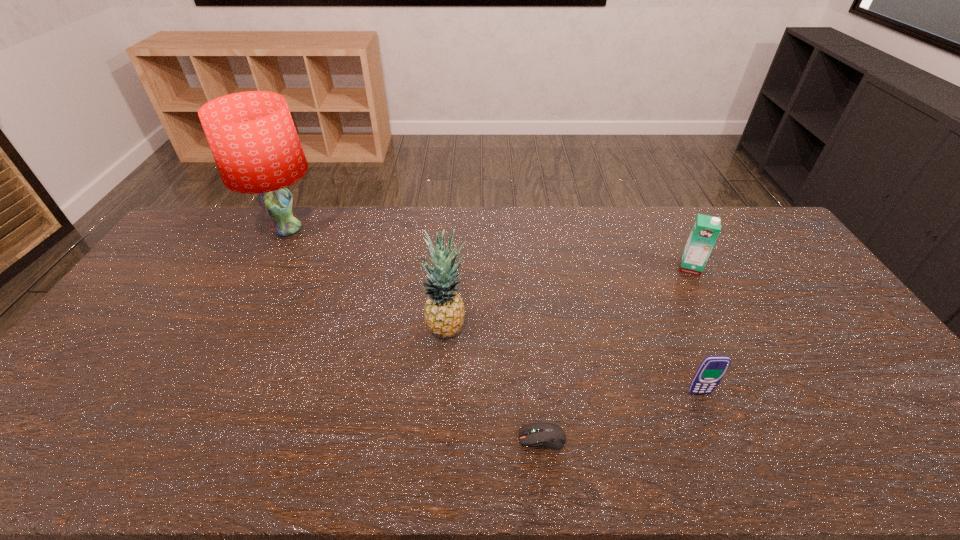
Where is `vacant space at the near edge of the desktop`? vacant space at the near edge of the desktop is located at coordinates (869, 463).

In the image, there is a desktop. What are the coordinates of `vacant area at the right edge` in the screenshot? It's located at (804, 334).

In the image, there is a desktop. Where is `free space at the far right corner`? The height and width of the screenshot is (540, 960). free space at the far right corner is located at coordinates (739, 232).

This screenshot has width=960, height=540. In order to click on free space at the near right corner in this screenshot , I will do `click(910, 469)`.

You are a GUI agent. You are given a task and a screenshot of the screen. Output one action in this format:
    pyautogui.click(x=<x>, y=<y>)
    Task: Click on the free space between the shortest object and the fourth tallest object
    The image size is (960, 540).
    Given the screenshot: What is the action you would take?
    pyautogui.click(x=620, y=416)

Where is `vacant area that lies between the farthest object and the nearest object`? vacant area that lies between the farthest object and the nearest object is located at coordinates (415, 334).

I want to click on empty space between the rightmost object and the fourth object from right to left, so click(x=568, y=298).

Identify the location of free space between the leftmost object and the cellular telephone. The image size is (960, 540). (493, 312).

Identify the location of empty space that is in between the cellular telephone and the farthest object. coord(493,312).

Find the location of a particular element. Image resolution: width=960 pixels, height=540 pixels. unoccupied area between the carton and the cellular telephone is located at coordinates (694, 330).